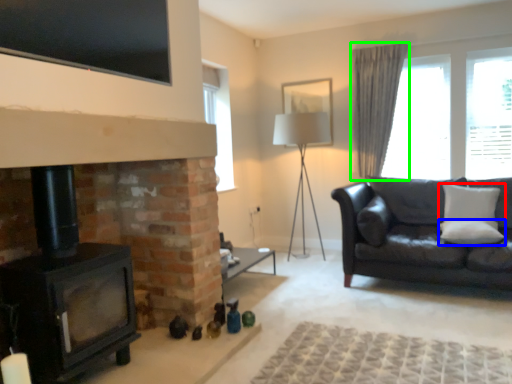
Question: Which object is the closest to the pillow (highlighted by a red box)? Choose among these: pillow (highlighted by a blue box) or curtain (highlighted by a green box).

Choices:
 (A) pillow
 (B) curtain

Answer: (A)